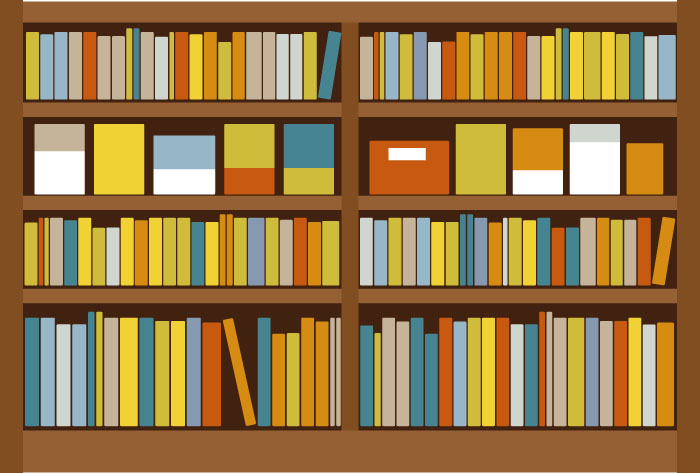
Where is `book on third shelf from bottom`? The width and height of the screenshot is (700, 473). book on third shelf from bottom is located at coordinates (60, 173), (127, 167), (187, 165), (239, 161), (309, 160), (391, 155), (488, 174), (536, 166), (596, 170), (640, 178).